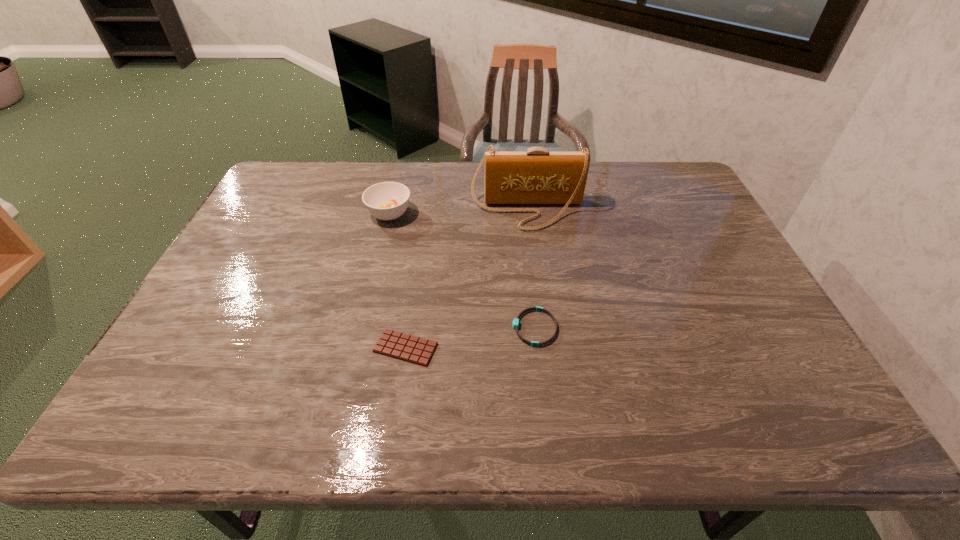
Where is `object that is at the far edge`? Image resolution: width=960 pixels, height=540 pixels. object that is at the far edge is located at coordinates (537, 176).

What are the coordinates of `vacant space at the far edge of the desktop` in the screenshot? It's located at (332, 176).

The height and width of the screenshot is (540, 960). In the image, there is a desktop. Identify the location of free space at the near edge. (253, 406).

Where is `free space at the left edge`? Image resolution: width=960 pixels, height=540 pixels. free space at the left edge is located at coordinates (271, 235).

The image size is (960, 540). In the image, there is a desktop. In order to click on vacant space at the right edge in this screenshot , I will do `click(723, 307)`.

Where is `free space between the candy bar and the second shortest object`? free space between the candy bar and the second shortest object is located at coordinates (470, 338).

The image size is (960, 540). Find the location of `unoccupied position between the shortest object and the wristband`. unoccupied position between the shortest object and the wristband is located at coordinates (470, 338).

Identify the location of empty location between the second shortest object and the handbag. The width and height of the screenshot is (960, 540). [531, 269].

Find the location of `free point between the third shortest object and the wristband`. free point between the third shortest object and the wristband is located at coordinates [x=462, y=271].

This screenshot has height=540, width=960. In order to click on vacant space that's between the second shortest object and the handbag in this screenshot , I will do `click(531, 269)`.